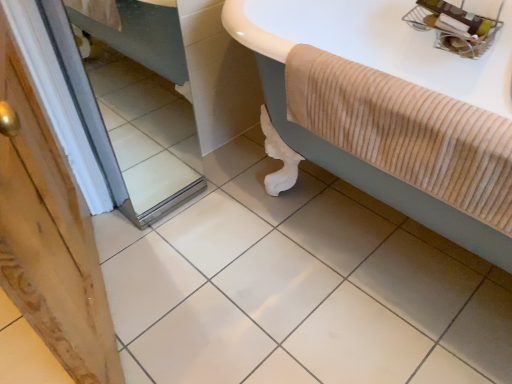
The height and width of the screenshot is (384, 512). Find the location of `free location to the right of mirror at left`. free location to the right of mirror at left is located at coordinates (239, 198).